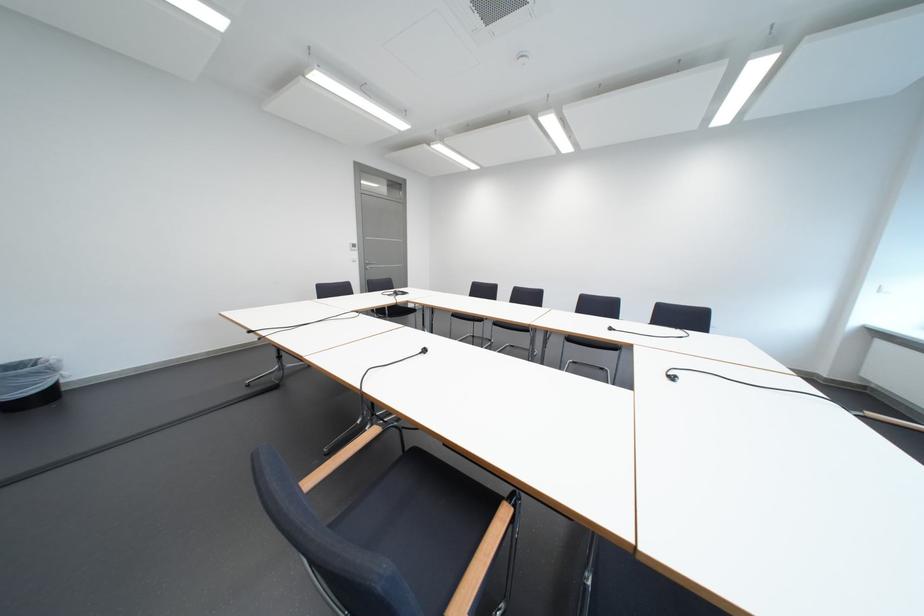
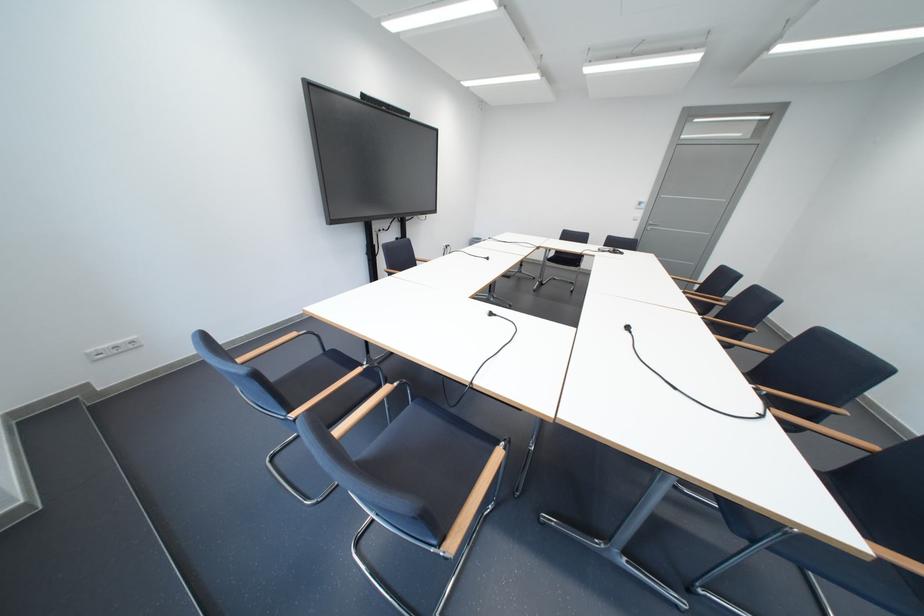
Question: I am providing you with two images of the same scene from different viewpoints. After the viewpoint changes to image2, which objects are now occluded?

Choices:
 (A) wooden chair armrest
 (B) stand adjustment knob
 (C) black electrical plug
 (D) blue chair sitting surface

Answer: (D)